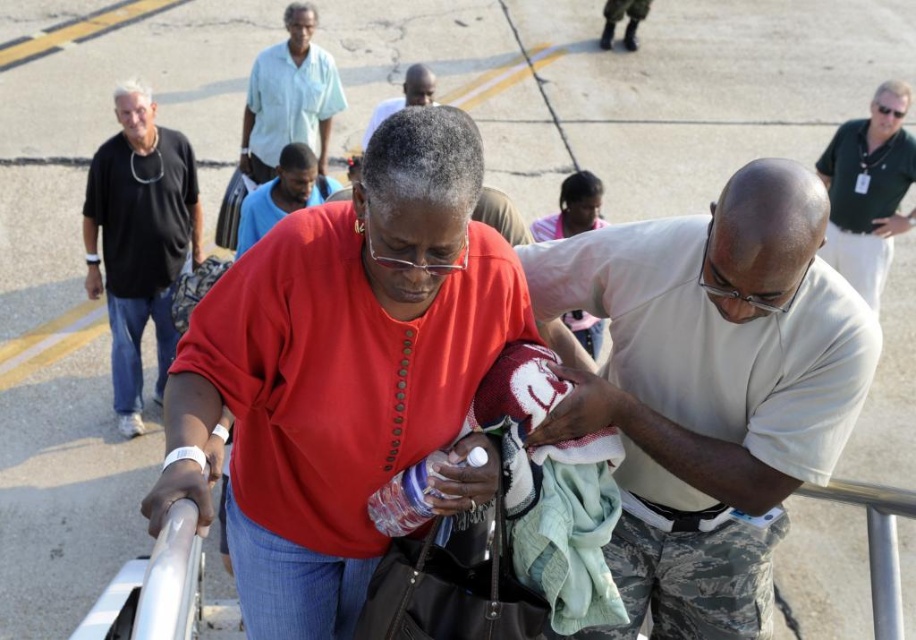
Question: Can you confirm if white uniform at center is wider than black matte shirt at left?

Choices:
 (A) yes
 (B) no

Answer: (A)

Question: Which object appears closest to the camera in this image?

Choices:
 (A) smooth skin face at center
 (B) matte red shirt at center
 (C) light blue cotton shirt at upper center

Answer: (B)

Question: Which point is closer to the camera?

Choices:
 (A) green shirt at upper right
 (B) matte red shirt at center

Answer: (B)

Question: Can you confirm if white uniform at center is smaller than black matte shirt at left?

Choices:
 (A) no
 (B) yes

Answer: (A)

Question: Does blue cotton shirt at center appear under matte pink shirt at center?

Choices:
 (A) no
 (B) yes

Answer: (A)

Question: Which point is farther from the camera taking this photo?

Choices:
 (A) (148, 157)
 (B) (762, 353)

Answer: (A)